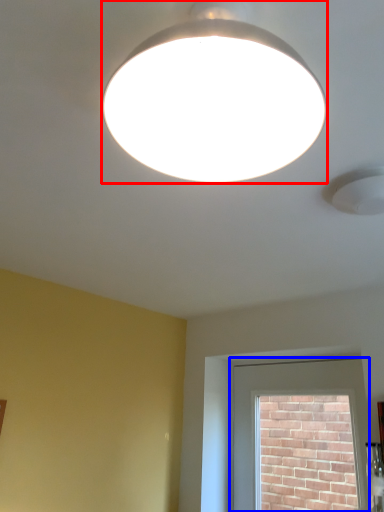
Question: Which object appears closest to the camera in this image, lamp (highlighted by a red box) or window (highlighted by a blue box)?

Choices:
 (A) lamp
 (B) window

Answer: (A)